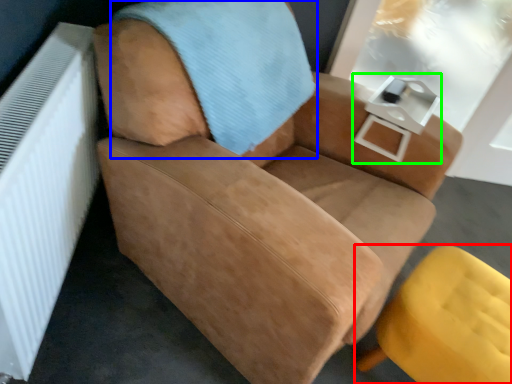
Question: Which is nearer to the chair (highlighted by a red box)? blanket (highlighted by a blue box) or table (highlighted by a green box).

Choices:
 (A) blanket
 (B) table

Answer: (B)